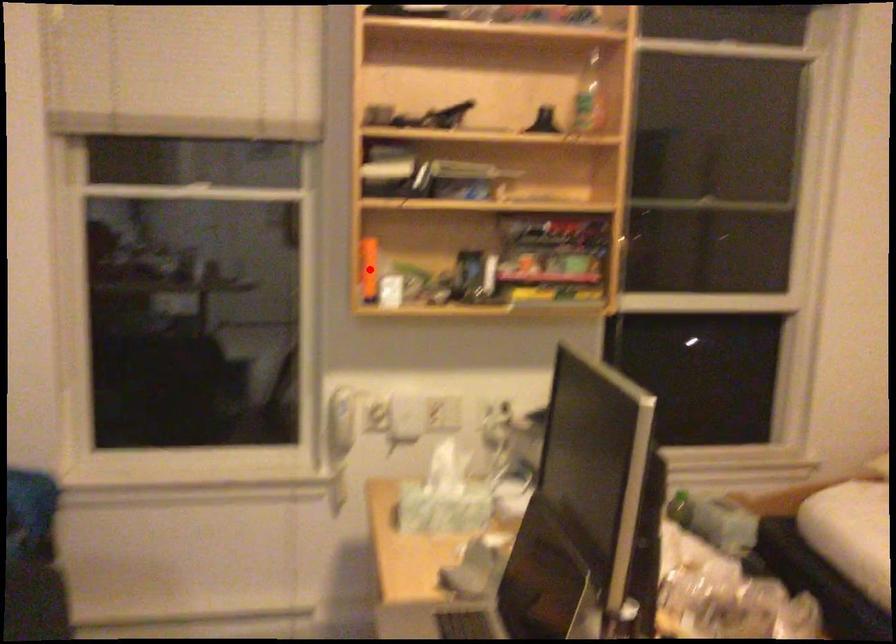
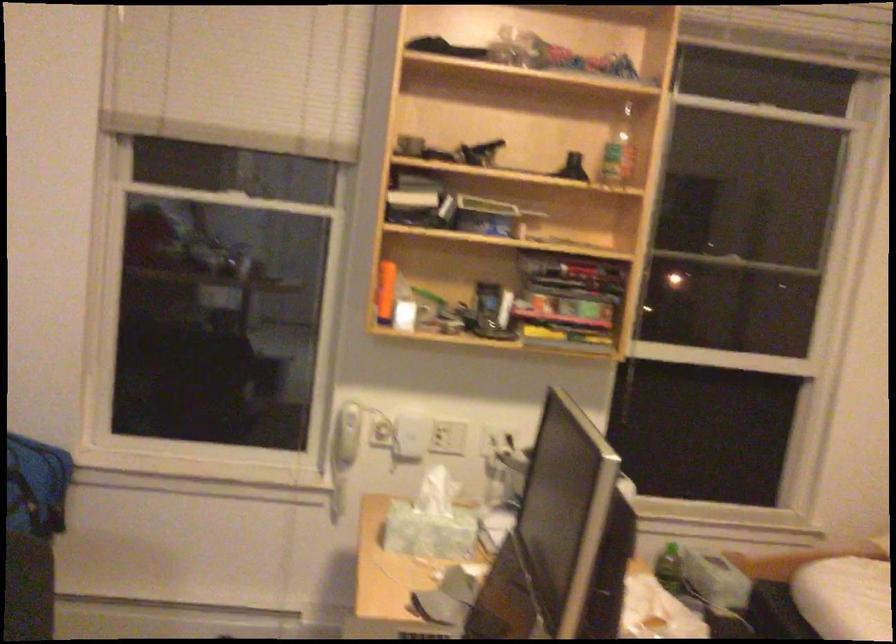
In the second image, find the point that corresponds to the highlighted location in the first image.

(384, 290)